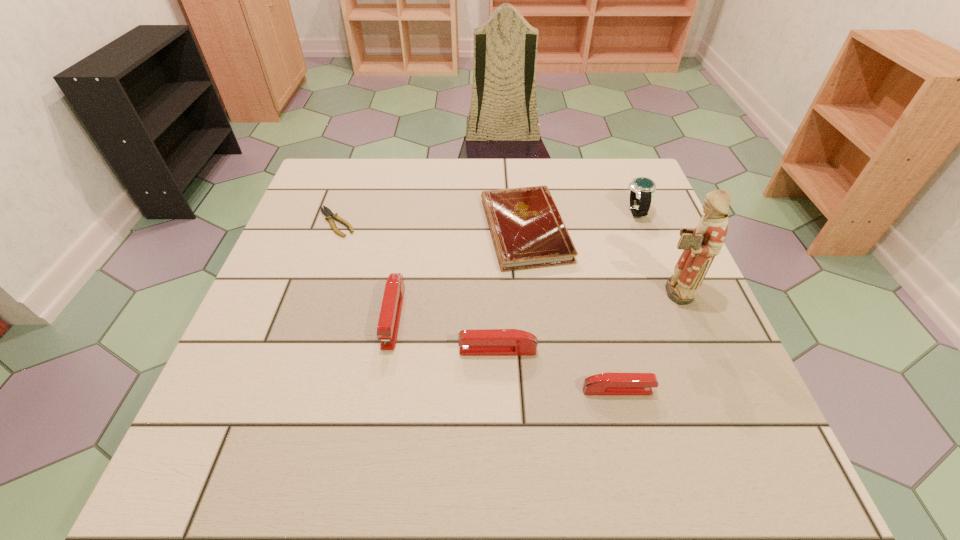
The image size is (960, 540). I want to click on the leftmost stapler, so click(x=388, y=325).

The width and height of the screenshot is (960, 540). I want to click on the second stapler from left to right, so click(x=486, y=342).

Locate an element on the screen. the second tallest stapler is located at coordinates (486, 342).

The image size is (960, 540). Find the location of `the third shortest object`. the third shortest object is located at coordinates (607, 383).

The width and height of the screenshot is (960, 540). Identify the location of the nearest stapler. (607, 383).

Identify the location of the leftmost object. The height and width of the screenshot is (540, 960). (331, 216).

Identify the location of pliers. (331, 216).

The height and width of the screenshot is (540, 960). What are the coordinates of `notebook` in the screenshot? It's located at (527, 229).

I want to click on watch, so click(x=642, y=189).

Image resolution: width=960 pixels, height=540 pixels. In order to click on figurine in this screenshot , I will do 701,244.